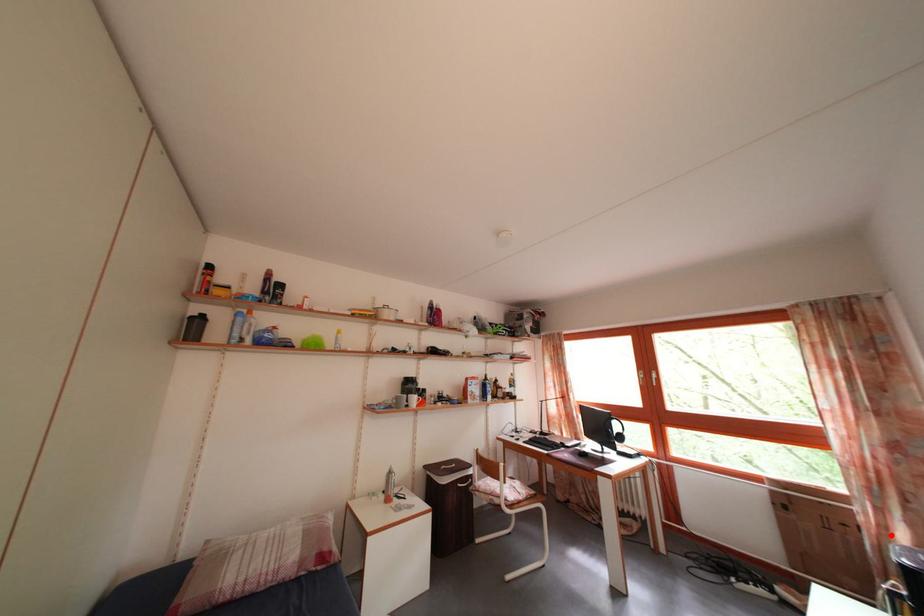
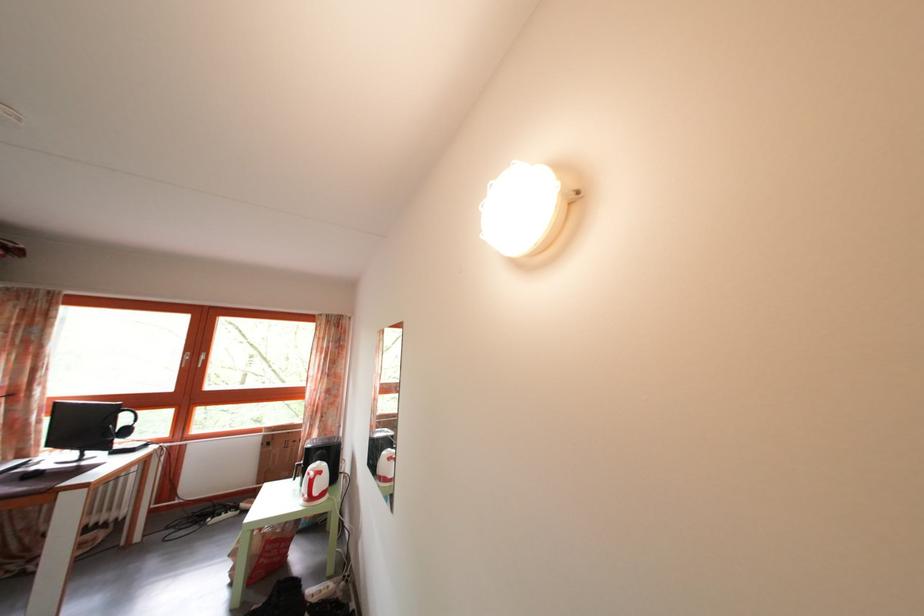
Where in the second image is the point corresponding to the highlighted location from the first image?

(317, 442)